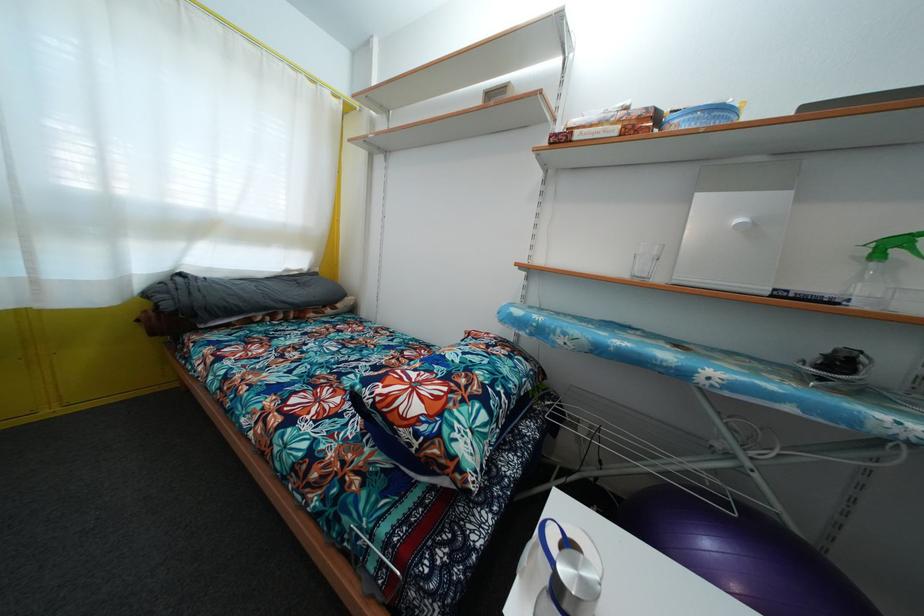
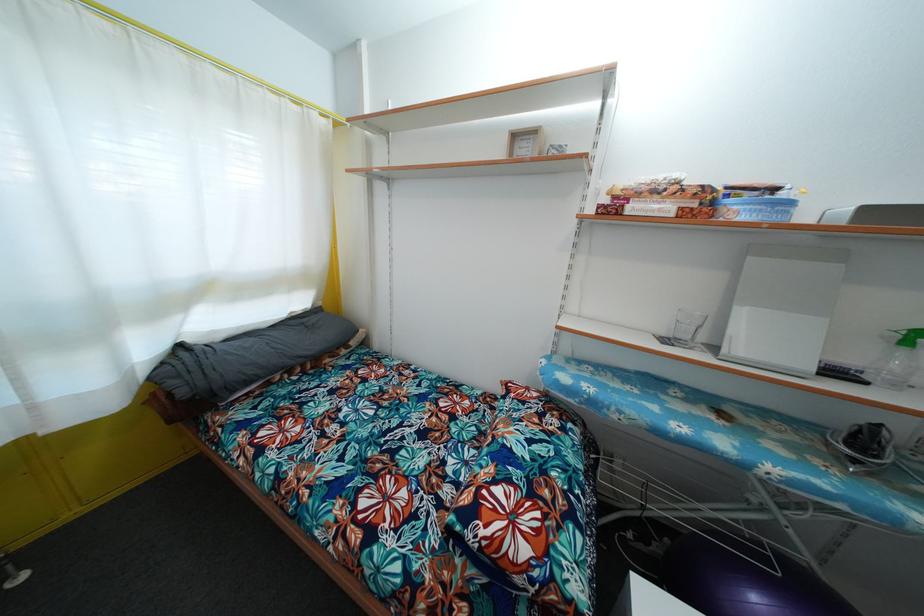
Question: The images are taken continuously from a first-person perspective. In which direction are you moving?

Choices:
 (A) Left
 (B) Right
 (C) Forward
 (D) Backward

Answer: (A)